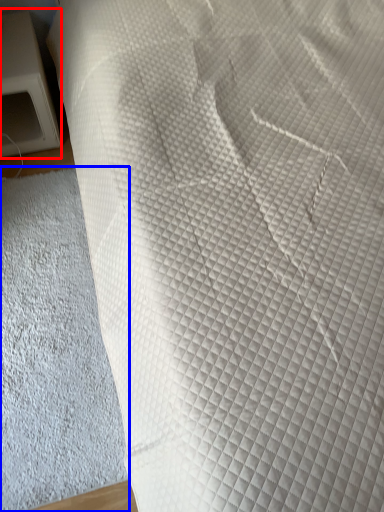
Question: Among these objects, which one is nearest to the camera, furniture (highlighted by a red box) or sheet (highlighted by a blue box)?

Choices:
 (A) furniture
 (B) sheet

Answer: (B)